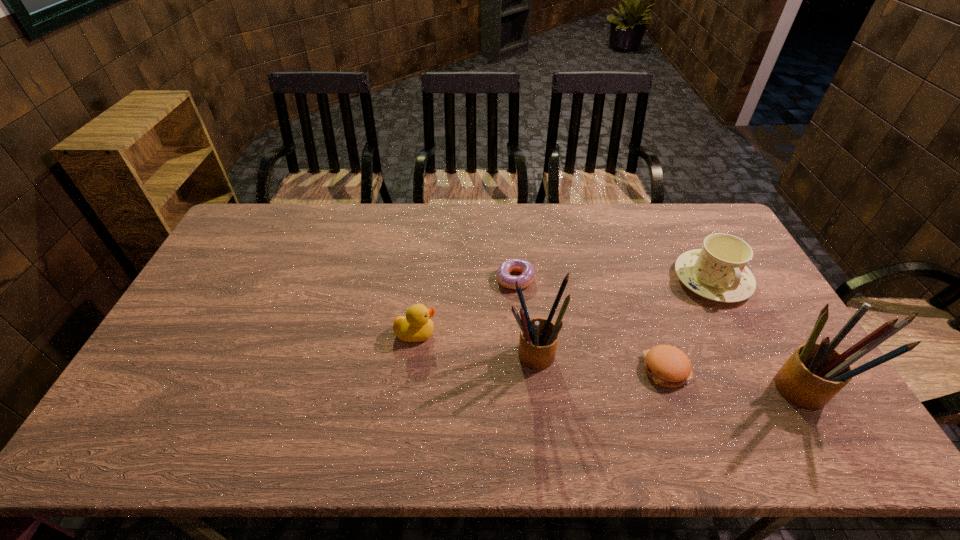
At what (x,y) coordinates should I click in order to perform the action: click on the left pencil box. Please return your answer as a coordinate pair (x, y). Looking at the image, I should click on [x=538, y=341].

The width and height of the screenshot is (960, 540). In order to click on the shorter pencil box in this screenshot , I will do `click(538, 341)`.

Locate an element on the screen. Image resolution: width=960 pixels, height=540 pixels. the tallest object is located at coordinates click(x=815, y=372).

Locate an element on the screen. The image size is (960, 540). the taller pencil box is located at coordinates (815, 372).

Locate an element on the screen. duckling is located at coordinates (416, 326).

Locate an element on the screen. the fourth tallest object is located at coordinates click(416, 326).

Locate an element on the screen. Image resolution: width=960 pixels, height=540 pixels. chinaware is located at coordinates (718, 271).

Image resolution: width=960 pixels, height=540 pixels. I want to click on doughnut, so click(x=525, y=267).

Locate an element on the screen. patty is located at coordinates (668, 366).

I want to click on vacant area located 0.180m on the right of the fifth shortest object, so click(627, 354).